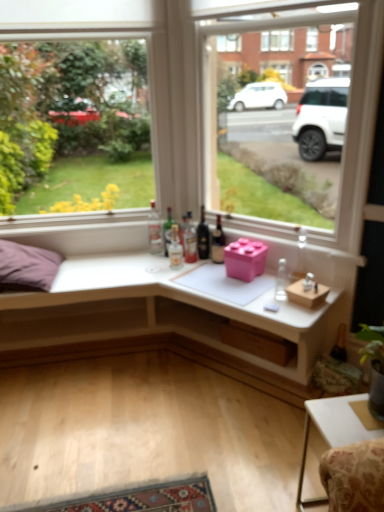
Identify the location of vacant space situated on the left part of clear glass bottle at center, positioned as the 7th bottle in left-to-right order. The height and width of the screenshot is (512, 384). (247, 297).